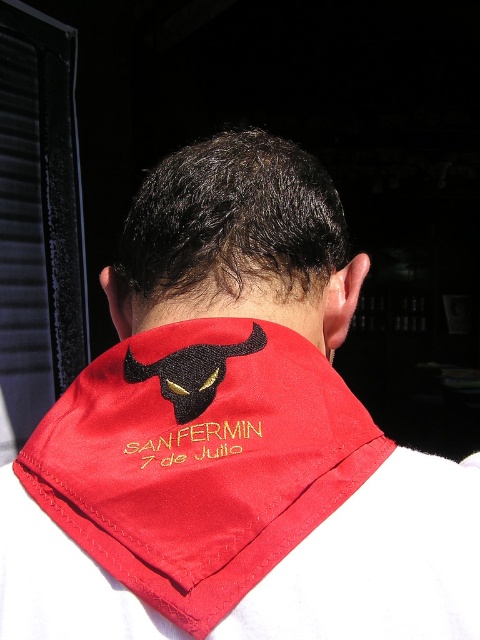
Is red satin neckband at back to the left of red satin bandana at center from the viewer's perspective?

Correct, you'll find red satin neckband at back to the left of red satin bandana at center.

Image resolution: width=480 pixels, height=640 pixels. What do you see at coordinates (200, 460) in the screenshot?
I see `red satin neckband at back` at bounding box center [200, 460].

The image size is (480, 640). Describe the element at coordinates (200, 460) in the screenshot. I see `red satin neckband at back` at that location.

Where is `red satin neckband at back`? This screenshot has width=480, height=640. red satin neckband at back is located at coordinates (200, 460).

Between red satin neckband at back and yellow embroidered text at center, which one has more height?

red satin neckband at back is taller.

Where is `red satin neckband at back`? red satin neckband at back is located at coordinates (200, 460).

The width and height of the screenshot is (480, 640). Identify the location of red satin neckband at back. (200, 460).

Is point (255, 216) behind point (152, 438)?

Yes, point (255, 216) is behind point (152, 438).

Who is more distant from viewer, (x=283, y=216) or (x=201, y=428)?

Positioned behind is point (x=283, y=216).

The height and width of the screenshot is (640, 480). What are the coordinates of `red satin bandana at center` in the screenshot? It's located at (237, 243).